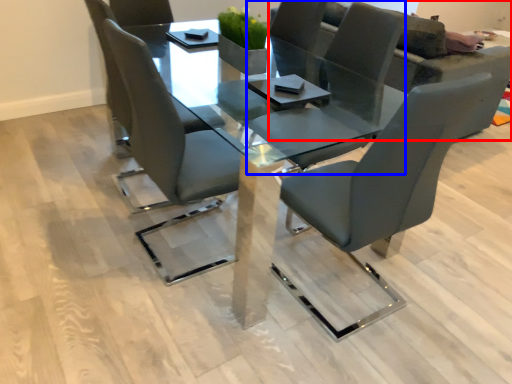
Question: Which object appears closest to the camera in this image, couch (highlighted by a red box) or chair (highlighted by a blue box)?

Choices:
 (A) couch
 (B) chair

Answer: (B)